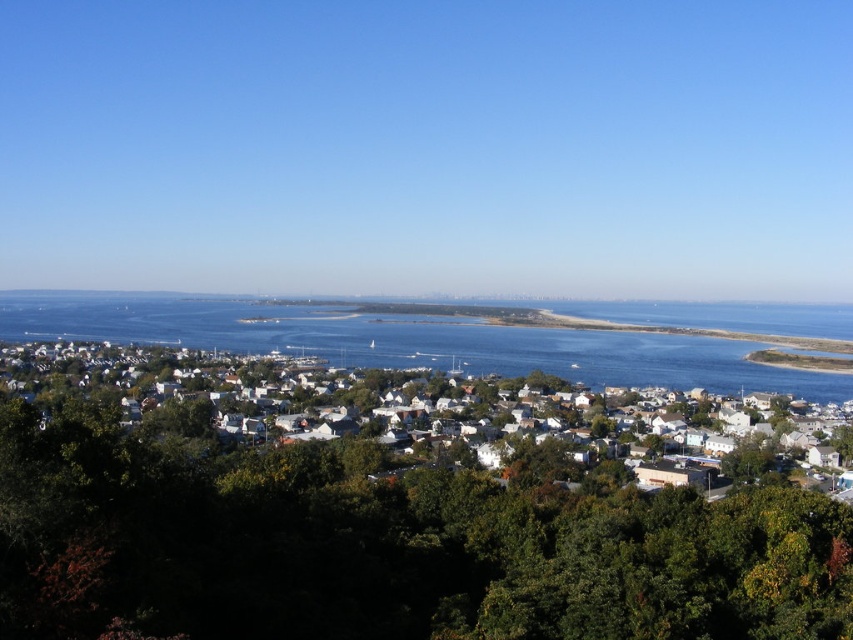
Which of these two, white matte houses at center or blue water at center, stands shorter?

Standing shorter between the two is blue water at center.

Who is more distant from viewer, (426, 445) or (352, 339)?

The point (352, 339) is more distant.

This screenshot has height=640, width=853. I want to click on white matte houses at center, so click(x=421, y=412).

Measure the distance between green leafy tree at center and white matte houses at center.

green leafy tree at center is 90.03 meters away from white matte houses at center.

Is point (495, 611) farther from viewer compared to point (572, 384)?

No, (495, 611) is closer to viewer.

Find the location of a particular element. This screenshot has height=640, width=853. green leafy tree at center is located at coordinates (387, 545).

Is point (126, 465) farther from viewer compared to point (154, 326)?

No, it is in front of (154, 326).

Is green leafy tree at center to the right of blue water at center from the viewer's perspective?

In fact, green leafy tree at center is to the left of blue water at center.

Does point (813, 547) come behind point (601, 356)?

No, (813, 547) is in front of (601, 356).

What are the coordinates of `green leafy tree at center` in the screenshot? It's located at (387, 545).